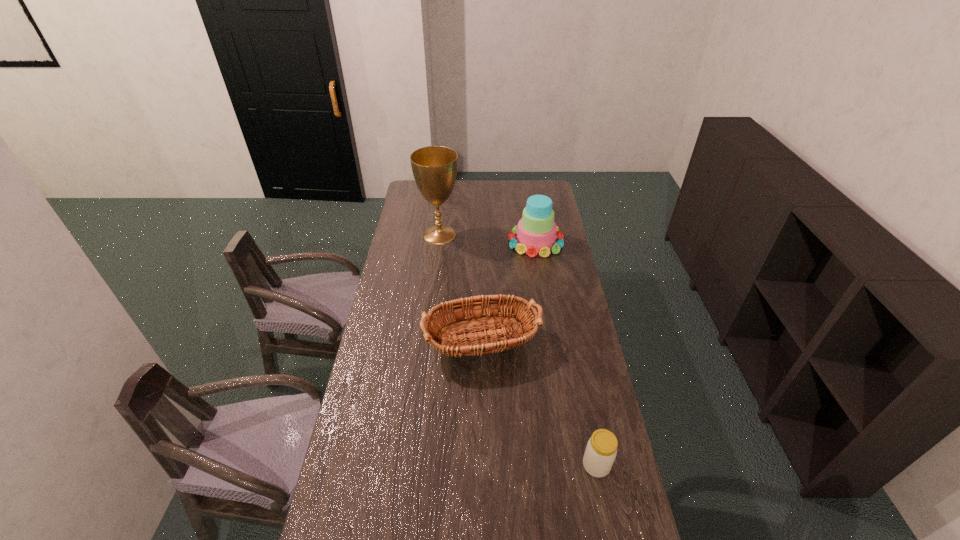
Locate an element on the screen. This screenshot has height=540, width=960. trophy cup is located at coordinates (434, 168).

Image resolution: width=960 pixels, height=540 pixels. In order to click on the second tallest object in this screenshot , I will do `click(536, 232)`.

At what (x,y) coordinates should I click in order to perform the action: click on the third tallest object. Please return your answer as a coordinate pair (x, y). The image size is (960, 540). Looking at the image, I should click on (480, 342).

Where is `basket`? basket is located at coordinates (480, 342).

Find the location of a particular element. the shortest object is located at coordinates (601, 450).

In order to click on the nearest object in this screenshot , I will do `click(601, 450)`.

This screenshot has width=960, height=540. Find the location of `free location located 0.180m on the front of the trophy cup`. free location located 0.180m on the front of the trophy cup is located at coordinates (435, 272).

Image resolution: width=960 pixels, height=540 pixels. I want to click on free spot located 0.250m on the back of the cake, so click(529, 201).

Where is `vacant space located 0.140m on the front of the second nearest object`? The height and width of the screenshot is (540, 960). vacant space located 0.140m on the front of the second nearest object is located at coordinates pos(476,422).

Identify the location of vacant space located 0.240m on the left of the shortest object. (502, 465).